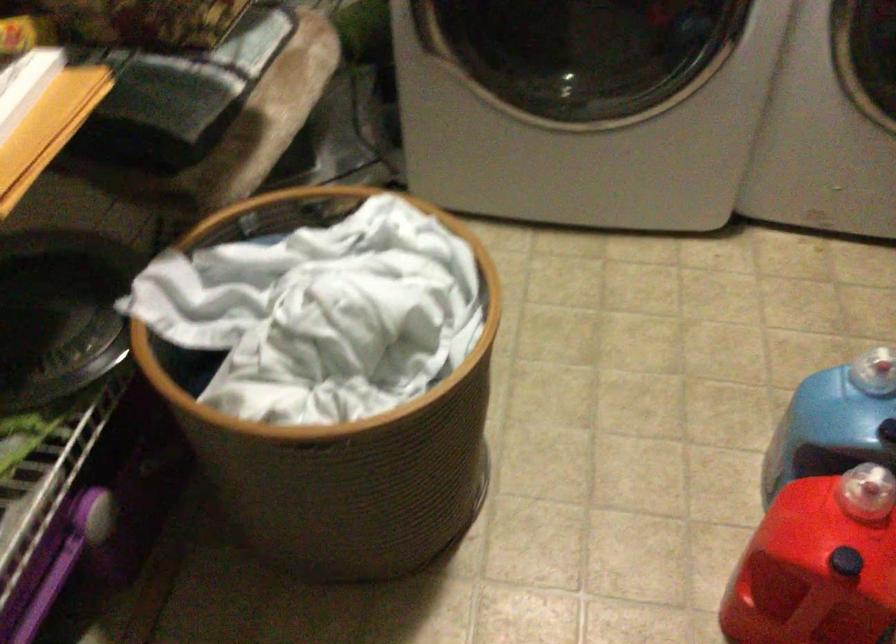
The height and width of the screenshot is (644, 896). I want to click on washing machine door, so click(581, 51).